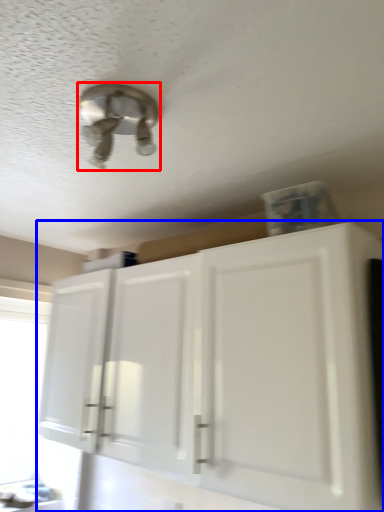
Question: Which object appears farthest to the camera in this image, light fixture (highlighted by a red box) or cabinetry (highlighted by a blue box)?

Choices:
 (A) light fixture
 (B) cabinetry

Answer: (B)